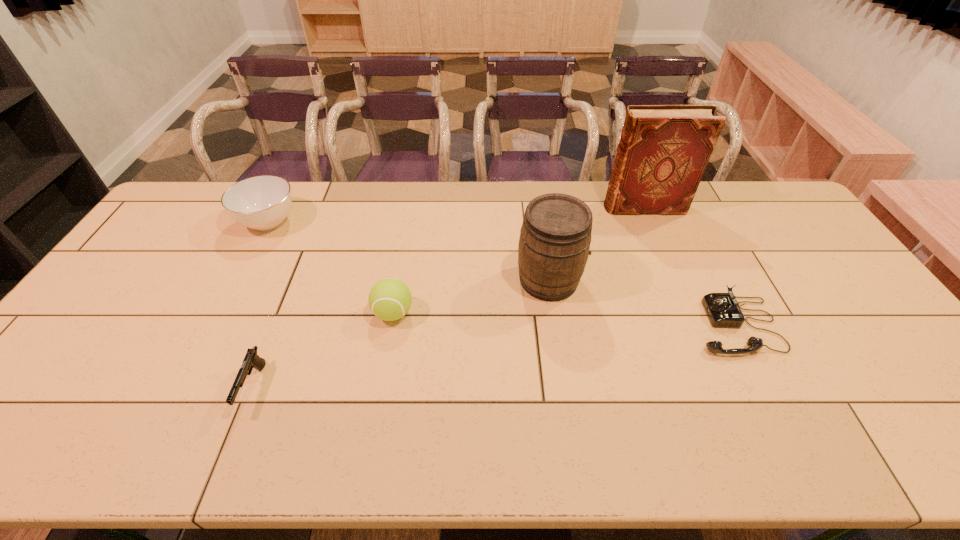
Locate an element on the screen. The height and width of the screenshot is (540, 960). hardback book is located at coordinates click(663, 151).

Identify the location of wine bucket. This screenshot has width=960, height=540. (555, 237).

Locate an element on the screen. This screenshot has width=960, height=540. the third object from right to left is located at coordinates [x=555, y=237].

Locate an element on the screen. The width and height of the screenshot is (960, 540). chinaware is located at coordinates (263, 202).

Locate an element on the screen. the third object from left to right is located at coordinates click(390, 299).

Where is `telephone`? telephone is located at coordinates (723, 310).

Locate an element on the screen. This screenshot has width=960, height=540. the nearest object is located at coordinates tap(251, 360).

This screenshot has width=960, height=540. I want to click on gun, so [x=251, y=360].

This screenshot has height=540, width=960. I want to click on vacant space situated 0.100m on the spine side of the tallest object, so click(x=575, y=207).

Locate an element on the screen. The image size is (960, 540). vacant space located 0.160m on the spine side of the tallest object is located at coordinates (558, 207).